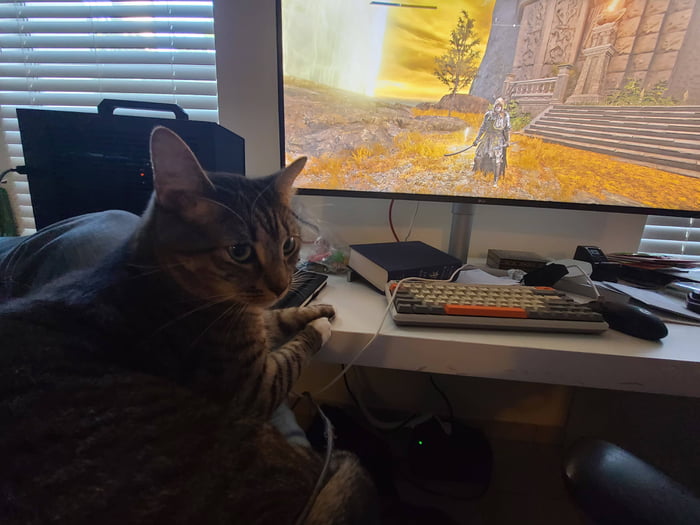
You are a GUI agent. You are given a task and a screenshot of the screen. Output one action in this format:
    pyautogui.click(x=<x>, y=<y>)
    Task: Click on the black tape dispenser
    
    Given the screenshot: What is the action you would take?
    pyautogui.click(x=602, y=258)